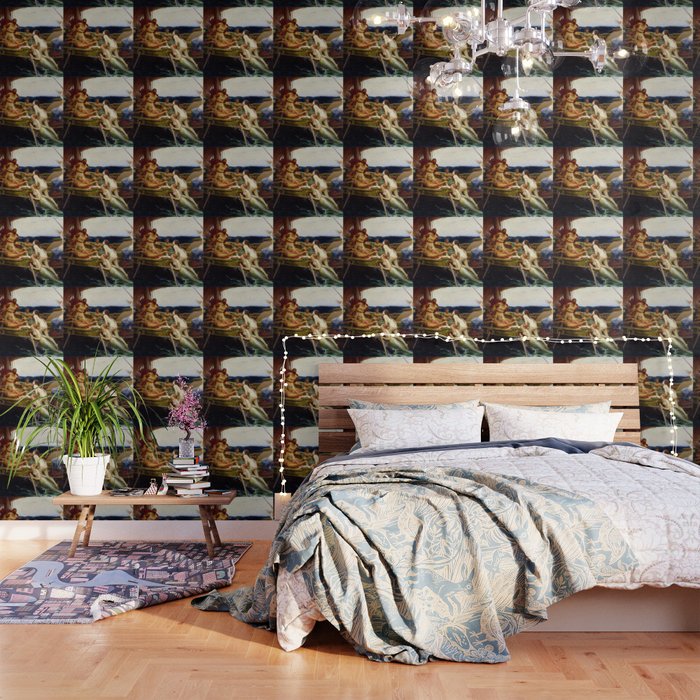
What are the coordinates of `bed frame` in the screenshot? It's located at [470, 376].